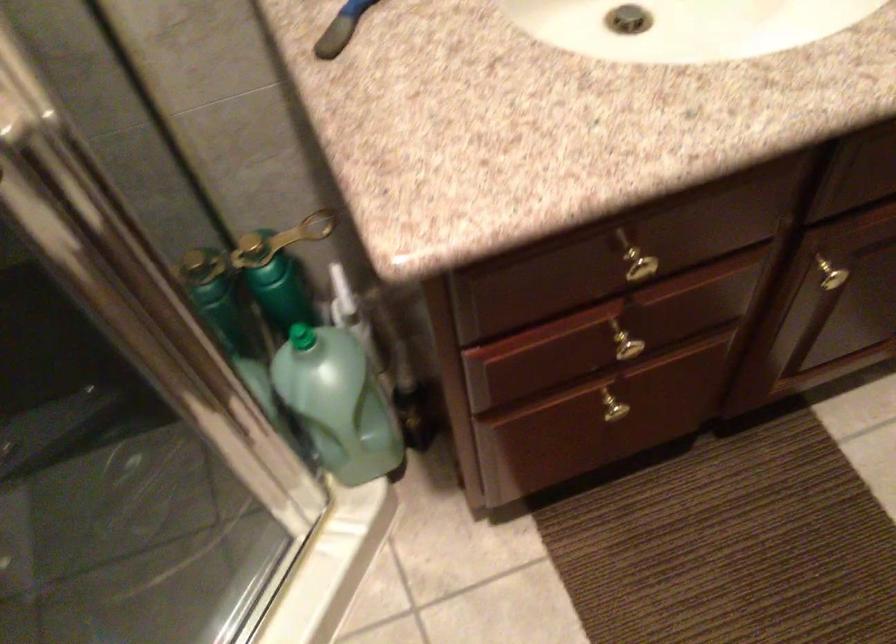
Where would you push the white bottle pump? Please return your answer as a coordinate pair (x, y).

(338, 402)